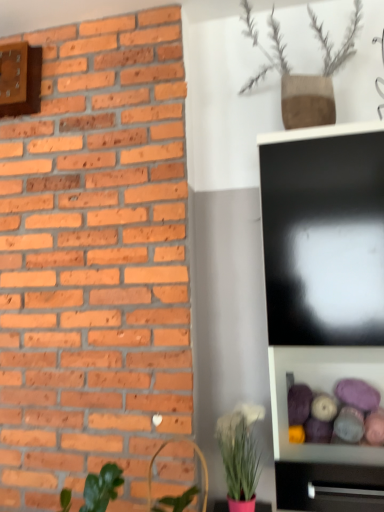
Question: From a real-world perspective, is black glossy tv cabinet at lower right above or below matte pink pot at lower center, which ranks as the first houseplant in bottom-to-top order?

Choices:
 (A) below
 (B) above

Answer: (A)

Question: In terms of width, does black glossy tv cabinet at lower right look wider or thinner when compared to matte pink pot at lower center, which ranks as the first houseplant in bottom-to-top order?

Choices:
 (A) thin
 (B) wide

Answer: (A)

Question: Which of these objects is positioned farthest from the matte pink pot at lower center, marked as the 2th houseplant in a top-to-bottom arrangement?

Choices:
 (A) brown textured vase at upper center, which is the 2th houseplant from bottom to top
 (B) black glossy tv cabinet at lower right
 (C) wooden clock at upper left

Answer: (C)

Question: Based on their relative distances, which object is nearer to the matte pink pot at lower center, which ranks as the first houseplant in bottom-to-top order?

Choices:
 (A) black glossy tv cabinet at lower right
 (B) wooden clock at upper left
 (C) brown textured vase at upper center, which is the 2th houseplant from bottom to top

Answer: (A)